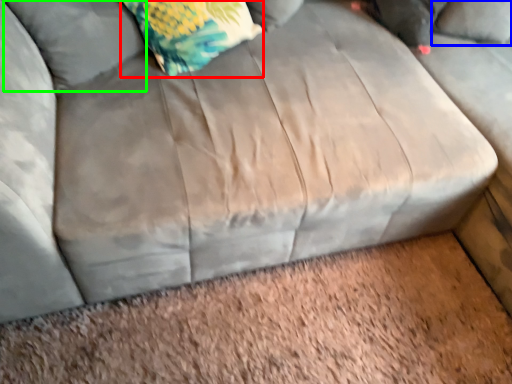
Question: Based on their relative distances, which object is nearer to throw pillow (highlighted by a red box)? Choose from pillow (highlighted by a blue box) and pillow (highlighted by a green box).

Choices:
 (A) pillow
 (B) pillow

Answer: (B)